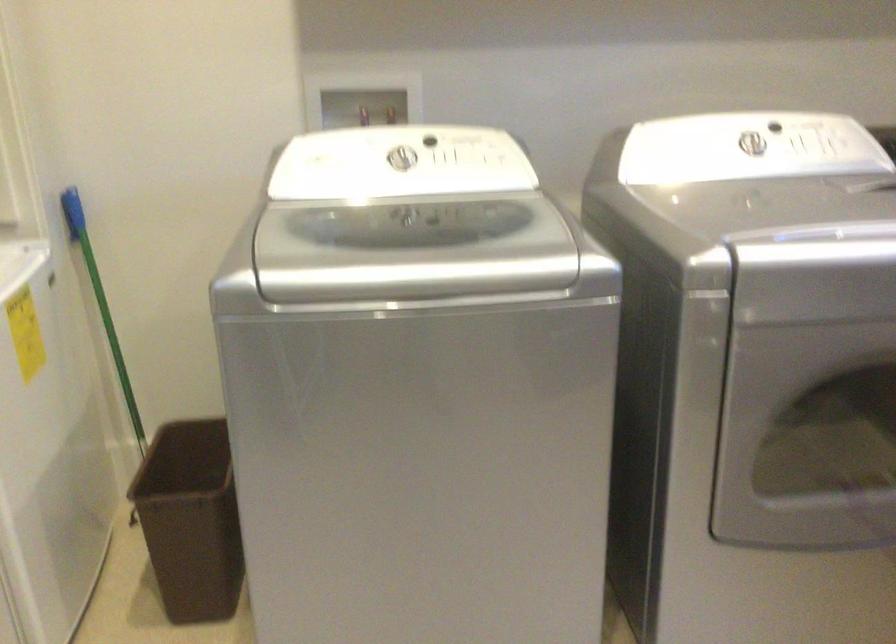
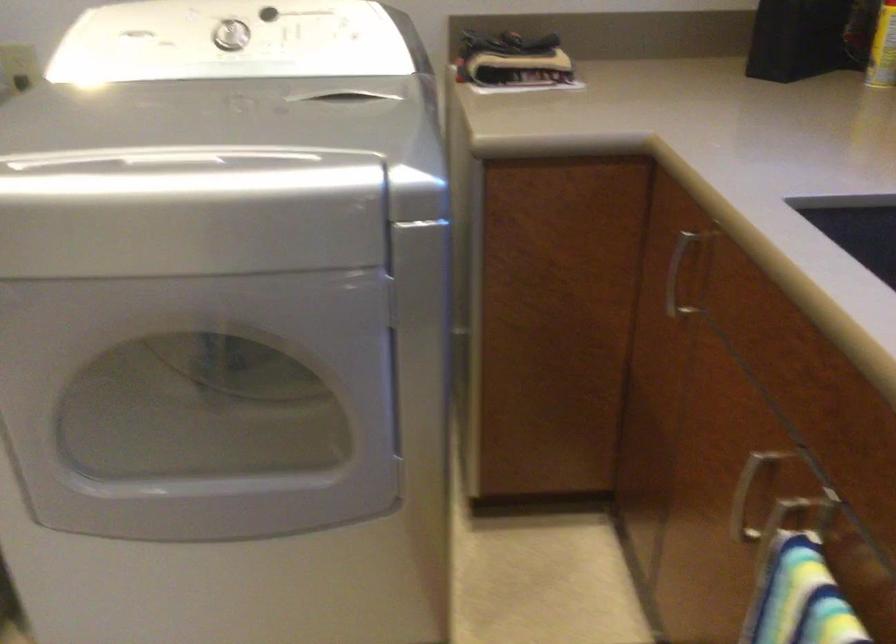
Question: What movement of the cameraman would produce the second image?

Choices:
 (A) Left
 (B) Right
 (C) Forward
 (D) Backward

Answer: (B)